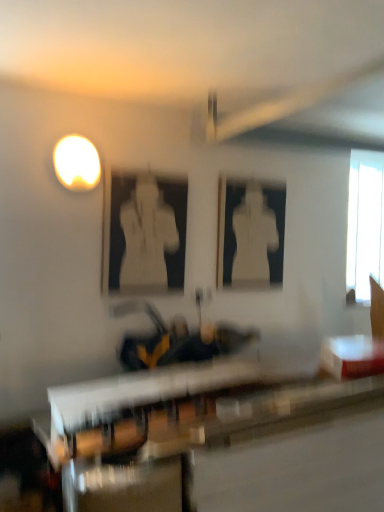
I want to click on white glossy table at lower right, which is the 1th table in top-to-bottom order, so click(x=352, y=356).

What do you see at coordinates (146, 238) in the screenshot?
I see `white glossy statue at center, which is the first person from front to back` at bounding box center [146, 238].

What are the coordinates of `matte white light at upper left` in the screenshot? It's located at (77, 163).

Is wooden table at center, marked as the 2th table in a top-to-bottom arrangement, far away from matte white light at upper left?

Indeed, wooden table at center, marked as the 2th table in a top-to-bottom arrangement, is not near matte white light at upper left.

From a real-world perspective, relative to matte white light at upper left, is wooden table at center, the first table in the bottom-to-top sequence, vertically above or below?

wooden table at center, the first table in the bottom-to-top sequence, is situated lower than matte white light at upper left in the real world.

Which object is thinner, wooden table at center, the first table in the bottom-to-top sequence, or matte white light at upper left?

With smaller width is matte white light at upper left.

From the picture: From the image's perspective, which is below, wooden table at center, the first table in the bottom-to-top sequence, or matte white light at upper left?

wooden table at center, the first table in the bottom-to-top sequence, is shown below in the image.

Is white glossy statue at center, which ranks as the first person in right-to-left order, facing towards wooden table at center, marked as the 2th table in a top-to-bottom arrangement?

No, white glossy statue at center, which ranks as the first person in right-to-left order, is not oriented towards wooden table at center, marked as the 2th table in a top-to-bottom arrangement.

Find the location of a particular element. The height and width of the screenshot is (512, 384). the 1st person directly above the wooden table at center, the first table in the bottom-to-top sequence (from a real-world perspective) is located at coordinates (253, 238).

Based on the photo, between white glossy statue at center, which appears as the second person when viewed from the left, and wooden table at center, the first table in the bottom-to-top sequence, which one has more height?

With more height is wooden table at center, the first table in the bottom-to-top sequence.

Would you consider white glossy statue at center, which appears as the second person when viewed from the left, to be distant from wooden table at center, marked as the 2th table in a top-to-bottom arrangement?

Yes, white glossy statue at center, which appears as the second person when viewed from the left, is far from wooden table at center, marked as the 2th table in a top-to-bottom arrangement.

Is white glossy table at lower right, arranged as the second table when ordered from the bottom, surrounded by wooden table at center, the first table in the bottom-to-top sequence?

No, wooden table at center, the first table in the bottom-to-top sequence, does not contain white glossy table at lower right, arranged as the second table when ordered from the bottom.

Considering the relative positions of wooden table at center, marked as the 2th table in a top-to-bottom arrangement, and white glossy table at lower right, arranged as the second table when ordered from the bottom, in the image provided, is wooden table at center, marked as the 2th table in a top-to-bottom arrangement, to the right of white glossy table at lower right, arranged as the second table when ordered from the bottom, from the viewer's perspective?

Incorrect, wooden table at center, marked as the 2th table in a top-to-bottom arrangement, is not on the right side of white glossy table at lower right, arranged as the second table when ordered from the bottom.

Is wooden table at center, marked as the 2th table in a top-to-bottom arrangement, looking in the opposite direction of white glossy table at lower right, which is the 1th table in top-to-bottom order?

No, wooden table at center, marked as the 2th table in a top-to-bottom arrangement, is not facing away from white glossy table at lower right, which is the 1th table in top-to-bottom order.

How much distance is there between wooden table at center, marked as the 2th table in a top-to-bottom arrangement, and white glossy table at lower right, arranged as the second table when ordered from the bottom?

A distance of 58.89 centimeters exists between wooden table at center, marked as the 2th table in a top-to-bottom arrangement, and white glossy table at lower right, arranged as the second table when ordered from the bottom.

Measure the distance between matte white light at upper left and white glossy table at lower right, arranged as the second table when ordered from the bottom.

matte white light at upper left and white glossy table at lower right, arranged as the second table when ordered from the bottom, are 4.87 feet apart from each other.

Is matte white light at upper left oriented away from white glossy table at lower right, which is the 1th table in top-to-bottom order?

matte white light at upper left does not have its back to white glossy table at lower right, which is the 1th table in top-to-bottom order.

Is matte white light at upper left beside white glossy table at lower right, arranged as the second table when ordered from the bottom?

matte white light at upper left is not next to white glossy table at lower right, arranged as the second table when ordered from the bottom, and they're not touching.

Does matte white light at upper left have a larger size compared to white glossy table at lower right, arranged as the second table when ordered from the bottom?

Actually, matte white light at upper left might be smaller than white glossy table at lower right, arranged as the second table when ordered from the bottom.

From the picture: Which of these two, white glossy statue at center, which ranks as the first person in right-to-left order, or transparent glass window at upper right, is bigger?

With larger size is transparent glass window at upper right.

Can transparent glass window at upper right be found inside white glossy statue at center, which appears as the second person when viewed from the left?

No, white glossy statue at center, which appears as the second person when viewed from the left, does not contain transparent glass window at upper right.

Which is behind, point (250, 250) or point (364, 297)?

The point (364, 297) is behind.

Is white glossy statue at center, which appears as the second person when viewed from the left, in contact with transparent glass window at upper right?

No, white glossy statue at center, which appears as the second person when viewed from the left, is not touching transparent glass window at upper right.

Considering the relative positions of wooden table at center, marked as the 2th table in a top-to-bottom arrangement, and transparent glass window at upper right in the image provided, is wooden table at center, marked as the 2th table in a top-to-bottom arrangement, to the right of transparent glass window at upper right from the viewer's perspective?

Incorrect, wooden table at center, marked as the 2th table in a top-to-bottom arrangement, is not on the right side of transparent glass window at upper right.

Is wooden table at center, the first table in the bottom-to-top sequence, looking in the opposite direction of transparent glass window at upper right?

That's not correct — wooden table at center, the first table in the bottom-to-top sequence, is not looking away from transparent glass window at upper right.

Between wooden table at center, the first table in the bottom-to-top sequence, and transparent glass window at upper right, which one has larger size?

With larger size is wooden table at center, the first table in the bottom-to-top sequence.

Which object is more forward, wooden table at center, the first table in the bottom-to-top sequence, or transparent glass window at upper right?

wooden table at center, the first table in the bottom-to-top sequence, is closer to the camera.

How far apart are white glossy statue at center, which is counted as the second person, starting from the right, and white glossy statue at center, arranged as the first person when viewed from the back?

The distance of white glossy statue at center, which is counted as the second person, starting from the right, from white glossy statue at center, arranged as the first person when viewed from the back, is 21.37 inches.

From a real-world perspective, relative to white glossy statue at center, arranged as the first person when viewed from the back, is white glossy statue at center, acting as the 1th person starting from the left, vertically above or below?

white glossy statue at center, acting as the 1th person starting from the left, is situated higher than white glossy statue at center, arranged as the first person when viewed from the back, in the real world.

Is white glossy statue at center, which is the first person from front to back, wider or thinner than white glossy statue at center, which ranks as the first person in right-to-left order?

white glossy statue at center, which is the first person from front to back, is thinner than white glossy statue at center, which ranks as the first person in right-to-left order.

Based on their positions, is white glossy statue at center, acting as the 1th person starting from the left, located to the left or right of white glossy statue at center, arranged as the first person when viewed from the back?

In the image, white glossy statue at center, acting as the 1th person starting from the left, appears on the left side of white glossy statue at center, arranged as the first person when viewed from the back.

The image size is (384, 512). In order to click on table that is the 2nd one when counting forward from the matte white light at upper left in this screenshot , I will do `click(216, 440)`.

From a real-world perspective, which person is the 1st one above the wooden table at center, marked as the 2th table in a top-to-bottom arrangement? Please provide its 2D coordinates.

[(253, 238)]

Based on their spatial positions, is wooden table at center, marked as the 2th table in a top-to-bottom arrangement, or white glossy statue at center, which is counted as the second person, starting from the right, closer to matte white light at upper left?

white glossy statue at center, which is counted as the second person, starting from the right.

From the image, which object appears to be nearer to transparent glass window at upper right, matte white light at upper left or wooden table at center, the first table in the bottom-to-top sequence?

The object closer to transparent glass window at upper right is wooden table at center, the first table in the bottom-to-top sequence.

Estimate the real-world distances between objects in this image. Which object is closer to wooden table at center, the first table in the bottom-to-top sequence, white glossy table at lower right, arranged as the second table when ordered from the bottom, or transparent glass window at upper right?

The object closer to wooden table at center, the first table in the bottom-to-top sequence, is white glossy table at lower right, arranged as the second table when ordered from the bottom.

Looking at the image, which one is located further to transparent glass window at upper right, white glossy table at lower right, which is the 1th table in top-to-bottom order, or matte white light at upper left?

matte white light at upper left.

From the image, which object appears to be nearer to matte white light at upper left, white glossy statue at center, which ranks as the first person in right-to-left order, or white glossy table at lower right, which is the 1th table in top-to-bottom order?

white glossy statue at center, which ranks as the first person in right-to-left order, lies closer to matte white light at upper left than the other object.

Based on their spatial positions, is white glossy statue at center, which is the 2th person from front to back, or white glossy statue at center, which is the first person from front to back, closer to white glossy table at lower right, arranged as the second table when ordered from the bottom?

white glossy statue at center, which is the 2th person from front to back, is closer to white glossy table at lower right, arranged as the second table when ordered from the bottom.

In the scene shown: Based on their spatial positions, is matte white light at upper left or wooden table at center, marked as the 2th table in a top-to-bottom arrangement, closer to white glossy statue at center, which is the 2th person from back to front?

matte white light at upper left is positioned closer to the anchor white glossy statue at center, which is the 2th person from back to front.

Looking at the image, which one is located closer to white glossy statue at center, which appears as the second person when viewed from the left, matte white light at upper left or white glossy table at lower right, which is the 1th table in top-to-bottom order?

white glossy table at lower right, which is the 1th table in top-to-bottom order, is closer to white glossy statue at center, which appears as the second person when viewed from the left.

You are a GUI agent. You are given a task and a screenshot of the screen. Output one action in this format:
    pyautogui.click(x=<x>, y=<y>)
    Task: Click on the person between white glossy statue at center, acting as the 1th person starting from the left, and transparent glass window at upper right, in the horizontal direction
    This screenshot has width=384, height=512.
    Given the screenshot: What is the action you would take?
    pyautogui.click(x=253, y=238)

Find the location of `table between wooden table at center, marked as the 2th table in a top-to-bottom arrangement, and transparent glass window at upper right in the front-back direction`. table between wooden table at center, marked as the 2th table in a top-to-bottom arrangement, and transparent glass window at upper right in the front-back direction is located at coordinates (352, 356).

This screenshot has height=512, width=384. Find the location of `light located between wooden table at center, marked as the 2th table in a top-to-bottom arrangement, and transparent glass window at upper right in the depth direction`. light located between wooden table at center, marked as the 2th table in a top-to-bottom arrangement, and transparent glass window at upper right in the depth direction is located at coordinates (77, 163).

In order to click on person between wooden table at center, marked as the 2th table in a top-to-bottom arrangement, and white glossy statue at center, which is the 2th person from front to back, along the z-axis in this screenshot , I will do `click(146, 238)`.